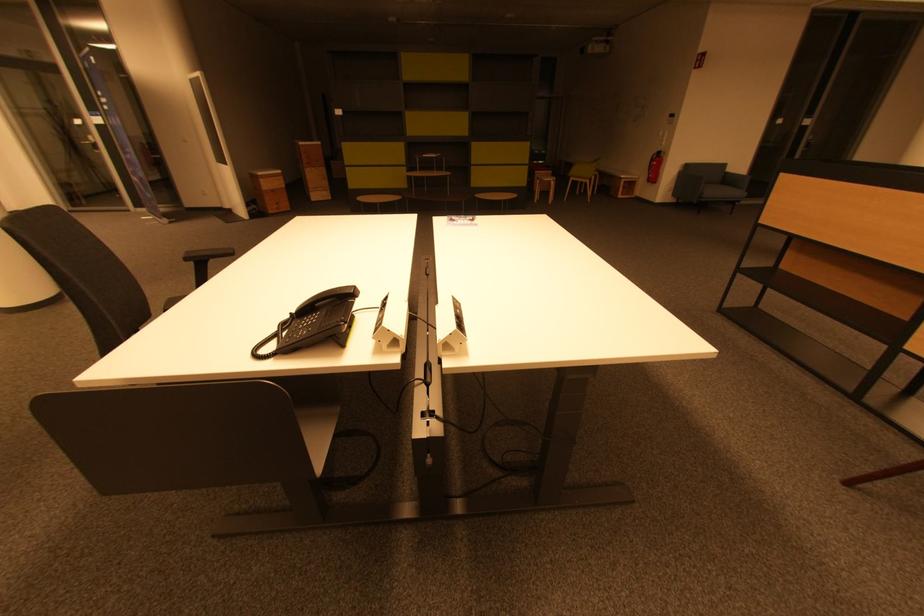
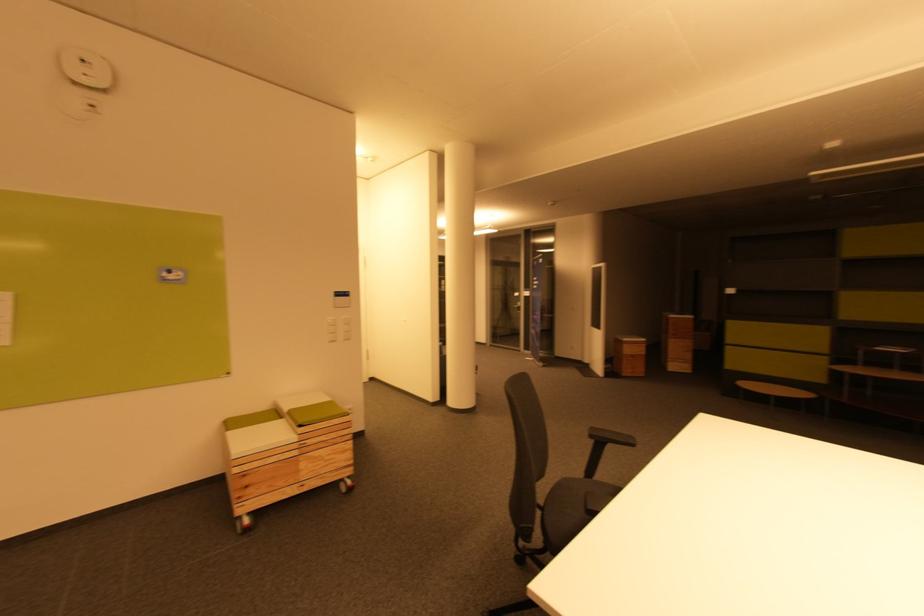
Where in the second image is the point corresponding to pixel 190 262 from the first image?

(596, 438)